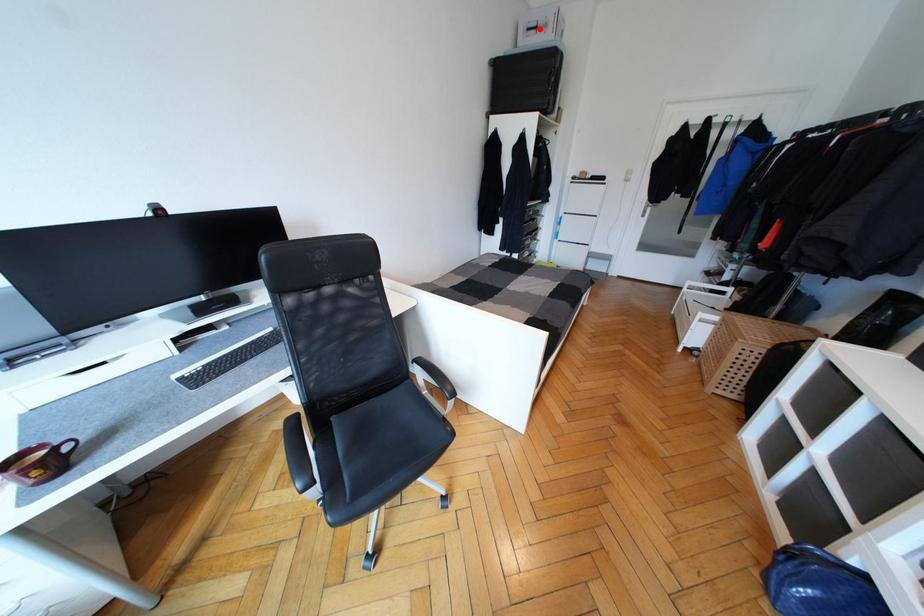
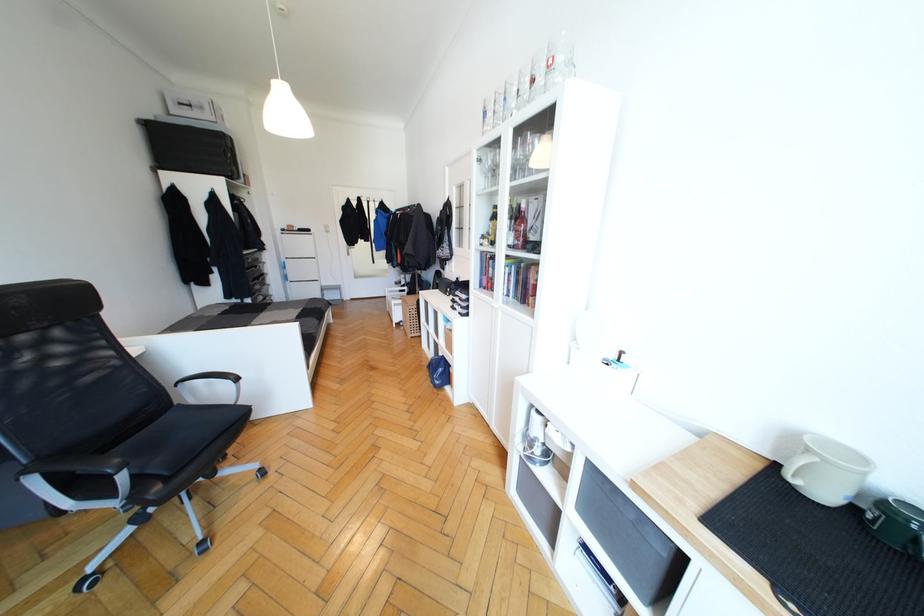
Find the pixel in the second image that matches the highlighted location in the first image.

(193, 108)